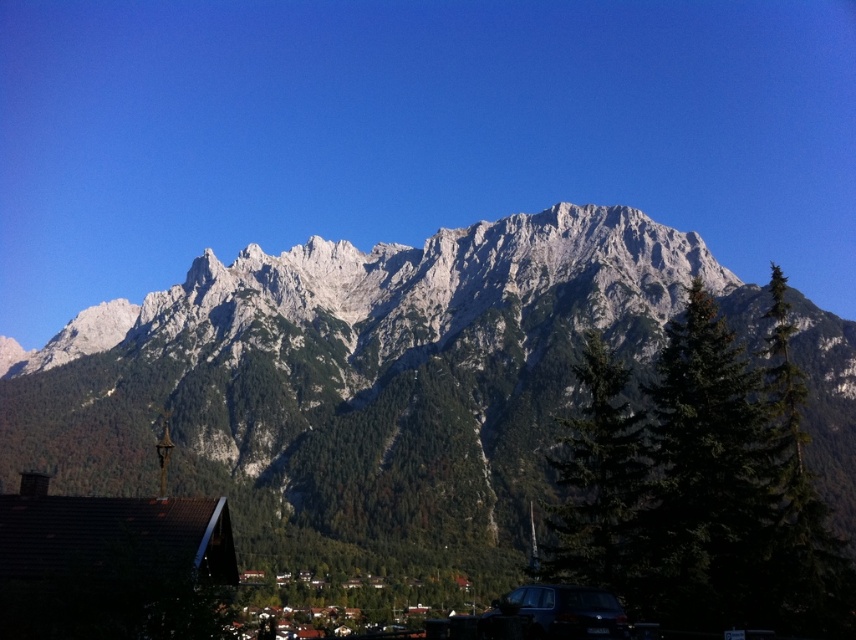
Question: Can you confirm if green textured tree at center is positioned above satin black car at lower center?

Choices:
 (A) yes
 (B) no

Answer: (A)

Question: Can you confirm if green textured tree at center is smaller than satin black car at lower center?

Choices:
 (A) yes
 (B) no

Answer: (B)

Question: Based on their relative distances, which object is nearer to the green coniferous tree at center?

Choices:
 (A) green textured tree at center
 (B) satin black car at lower center

Answer: (A)

Question: Among these objects, which one is nearest to the camera?

Choices:
 (A) green coniferous tree at center
 (B) satin black car at lower center

Answer: (B)

Question: In this image, where is green coniferous tree at center located relative to satin black car at lower center?

Choices:
 (A) above
 (B) below

Answer: (A)

Question: Which is nearer to the satin black car at lower center?

Choices:
 (A) green coniferous tree at center
 (B) green textured tree at center

Answer: (B)